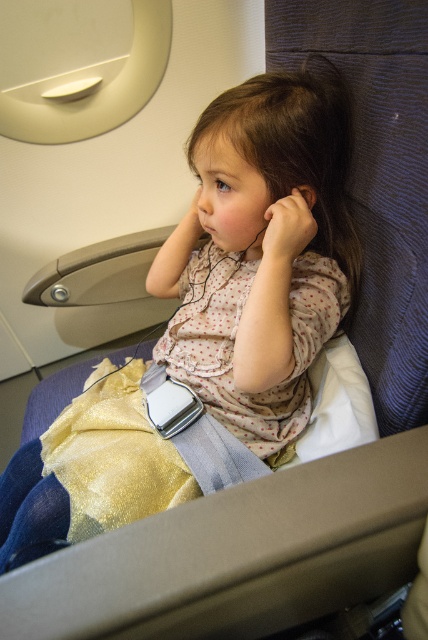
You are a flight attendant checking seat dimensions. The gold glitter skirt at center and the matte skin hand at center are both on the child. Which object is positioned higher up?

The gold glitter skirt at center is much taller than the matte skin hand at center, so it is positioned higher up.

You are a flight attendant checking the seating arrangement. You notice the gold glitter skirt at center and the matte skin hand at center. Which object is positioned to the right side?

The matte skin hand at center is positioned to the right of the gold glitter skirt at center.

You are a flight attendant checking seatbelts. You notice the gold glitter skirt at center and the matte skin hand at center. Which object is closer to you, the flight attendant, as you look at the passenger?

The gold glitter skirt at center is closer to the viewer than the matte skin hand at center, so the gold glitter skirt at center is closer to you as the flight attendant.